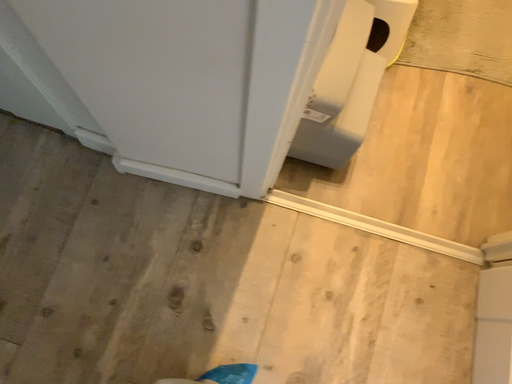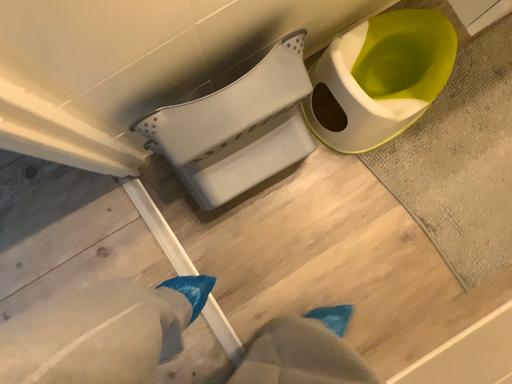
Question: How did the camera likely rotate when shooting the video?

Choices:
 (A) rotated downward
 (B) rotated upward

Answer: (A)